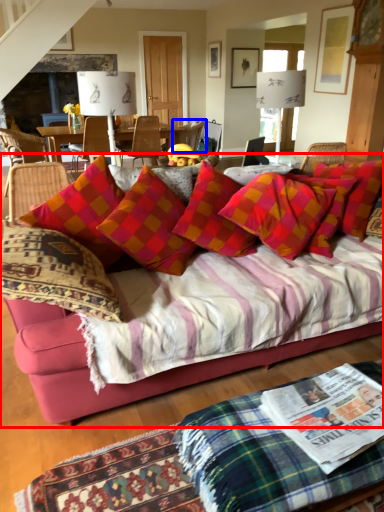
Question: Which of the following is the closest to the observer, studio couch (highlighted by a red box) or chair (highlighted by a blue box)?

Choices:
 (A) studio couch
 (B) chair

Answer: (A)